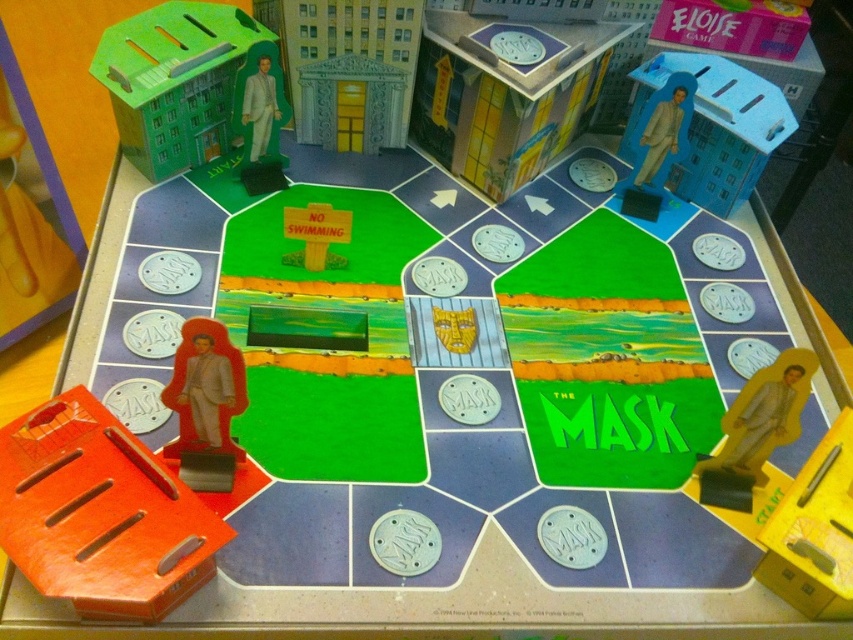
Question: Which of these objects is positioned farthest from the matte gray suit at upper center?

Choices:
 (A) orange plastic tray at lower left
 (B) matte red figurine at lower left
 (C) matte plastic figure at upper right

Answer: (C)

Question: Which object is the closest to the orange plastic tray at lower left?

Choices:
 (A) matte plastic building at upper center
 (B) green cardboard building at upper left

Answer: (B)

Question: Considering the relative positions of matte plastic figure at upper right and matte red figurine at lower left in the image provided, where is matte plastic figure at upper right located with respect to matte red figurine at lower left?

Choices:
 (A) left
 (B) right

Answer: (B)

Question: Can you confirm if green cardboard building at upper left is positioned to the right of matte plastic figure at upper right?

Choices:
 (A) no
 (B) yes

Answer: (A)

Question: Is green cardboard building at upper left smaller than matte red figurine at lower left?

Choices:
 (A) no
 (B) yes

Answer: (A)

Question: Among these objects, which one is farthest from the camera?

Choices:
 (A) matte plastic figure at upper right
 (B) orange plastic tray at lower left

Answer: (A)